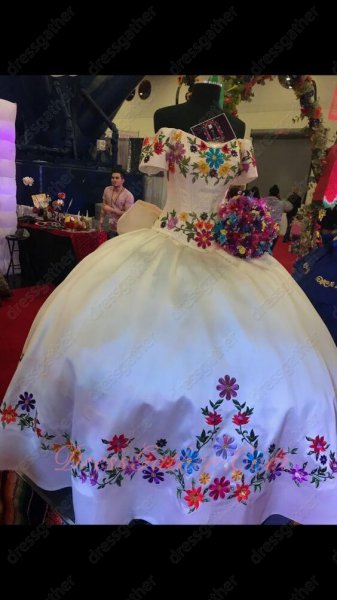
Where is `table`? The height and width of the screenshot is (600, 337). table is located at coordinates (81, 234).